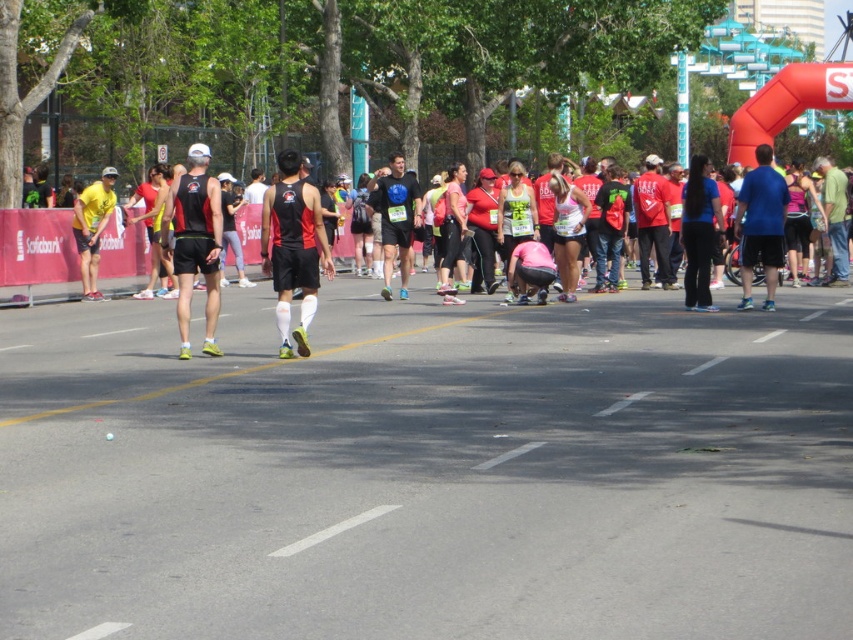
You are a photographer standing at the starting line of the marathon, and you want to capture a closeup shot of the black athletic wear at center. Considering your camera has a minimum focusing distance of 10 meters, can you take the photo without moving closer?

The black athletic wear at center is 13.15 meters away from viewer. Since the minimum focusing distance is 10 meters, the photographer can take the photo without moving closer as the distance is sufficient.

Based on the photo, you are a photographer at the marathon event and want to capture a photo that includes both the matte black tank top at center and the yellow matte tank top at left. Based on their positions, which runner is closer to the camera?

→ The matte black tank top at center is positioned under the yellow matte tank top at left, meaning the yellow matte tank top at left is closer to the camera.